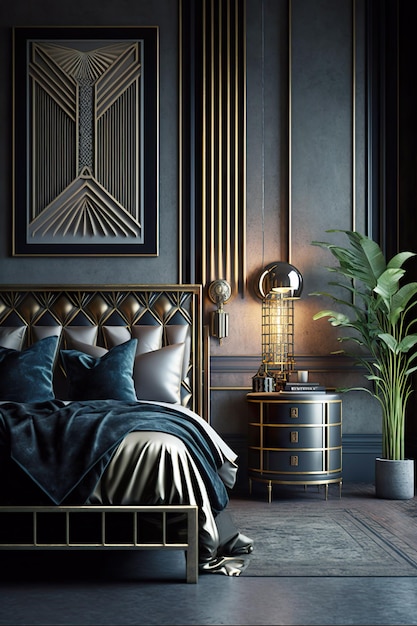
Identify the location of potted plant. The height and width of the screenshot is (626, 417). (393, 439).